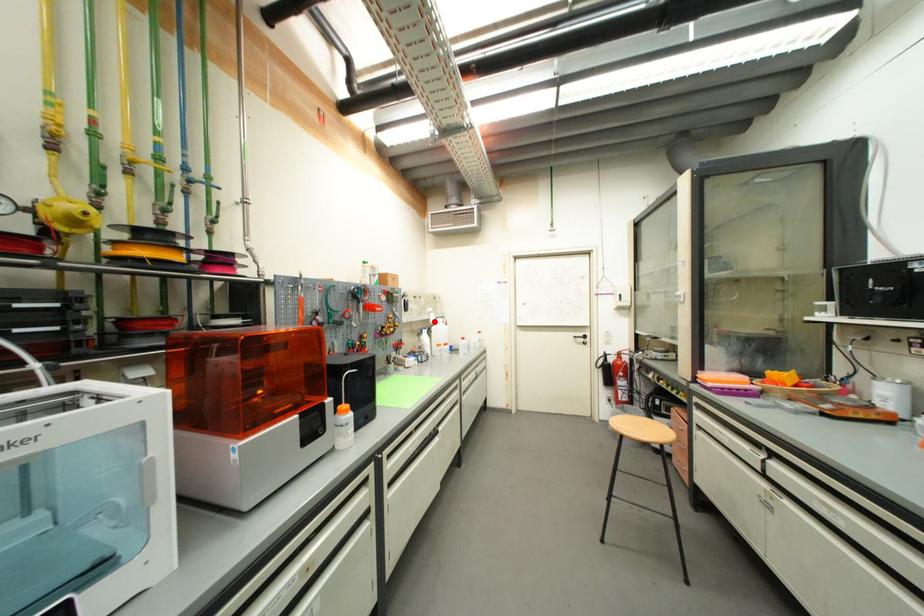
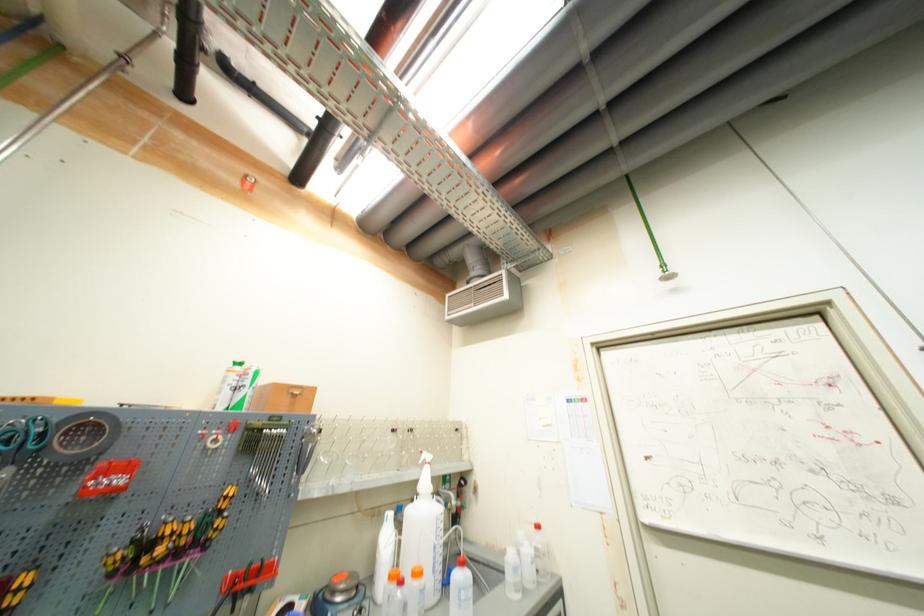
Find the pixel in the second image that matches the highlighted location in the first image.

(421, 484)